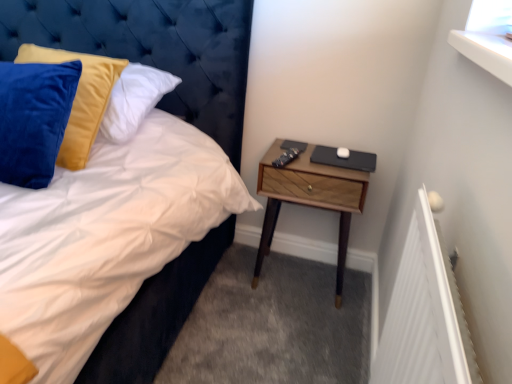
Question: Looking at the image, does wooden nightstand at right seem bigger or smaller compared to velvet blue headboard at upper left?

Choices:
 (A) small
 (B) big

Answer: (A)

Question: From a real-world perspective, is wooden nightstand at right positioned above or below velvet blue headboard at upper left?

Choices:
 (A) above
 (B) below

Answer: (B)

Question: In terms of width, does wooden nightstand at right look wider or thinner when compared to velvet blue headboard at upper left?

Choices:
 (A) wide
 (B) thin

Answer: (B)

Question: Is velvet blue headboard at upper left wider or thinner than wooden nightstand at right?

Choices:
 (A) wide
 (B) thin

Answer: (A)

Question: In the image, is velvet blue headboard at upper left positioned in front of or behind wooden nightstand at right?

Choices:
 (A) behind
 (B) front

Answer: (B)

Question: From a real-world perspective, is velvet blue headboard at upper left above or below wooden nightstand at right?

Choices:
 (A) above
 (B) below

Answer: (A)

Question: In the image, is velvet blue headboard at upper left on the left side or the right side of wooden nightstand at right?

Choices:
 (A) right
 (B) left

Answer: (B)